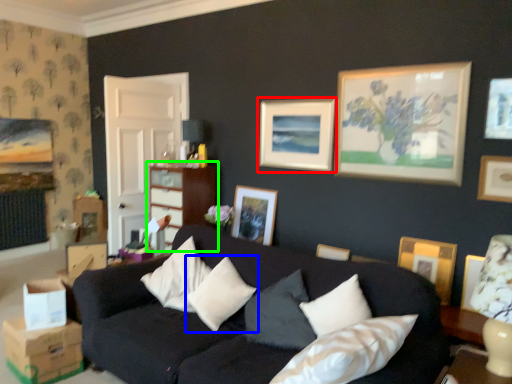
Question: Which object is the closest to the picture frame (highlighted by a red box)? Choose among these: pillow (highlighted by a blue box) or dresser (highlighted by a green box).

Choices:
 (A) pillow
 (B) dresser

Answer: (B)